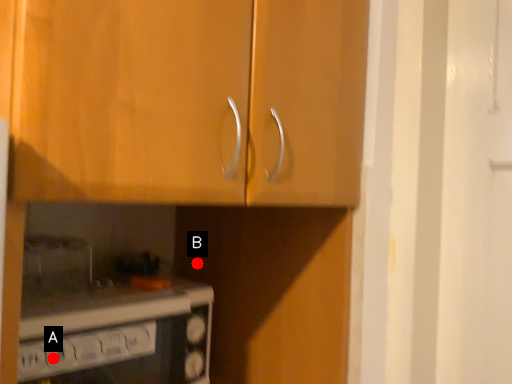
Question: Two points are circled on the image, labeled by A and B beside each circle. Among these points, which one is farthest from the camera?

Choices:
 (A) A is further
 (B) B is further

Answer: (B)